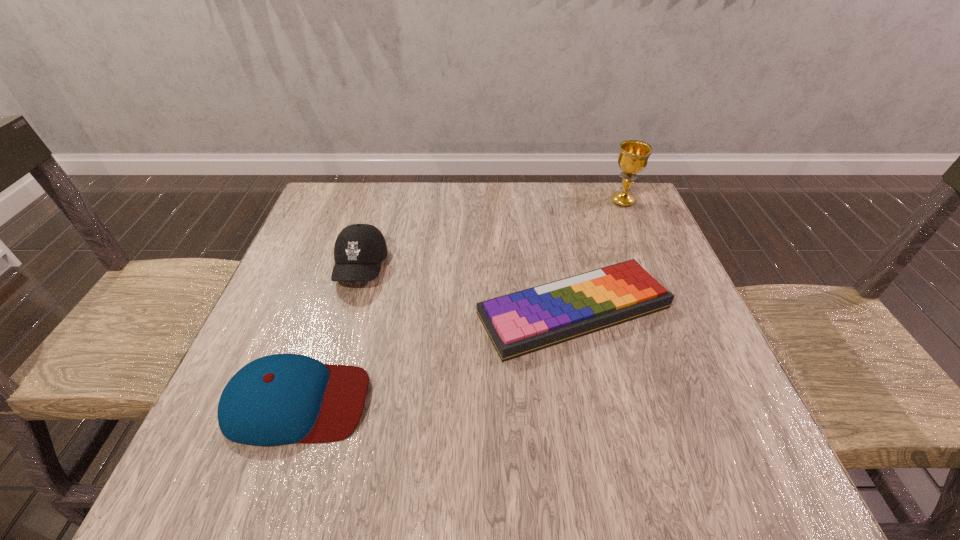
The width and height of the screenshot is (960, 540). In order to click on blank area in the image that satisfies the following two spatial constraints: 1. on the front-facing side of the taller baseball cap; 2. with the bill of the second shortest object facing forward in this screenshot , I will do coord(321,402).